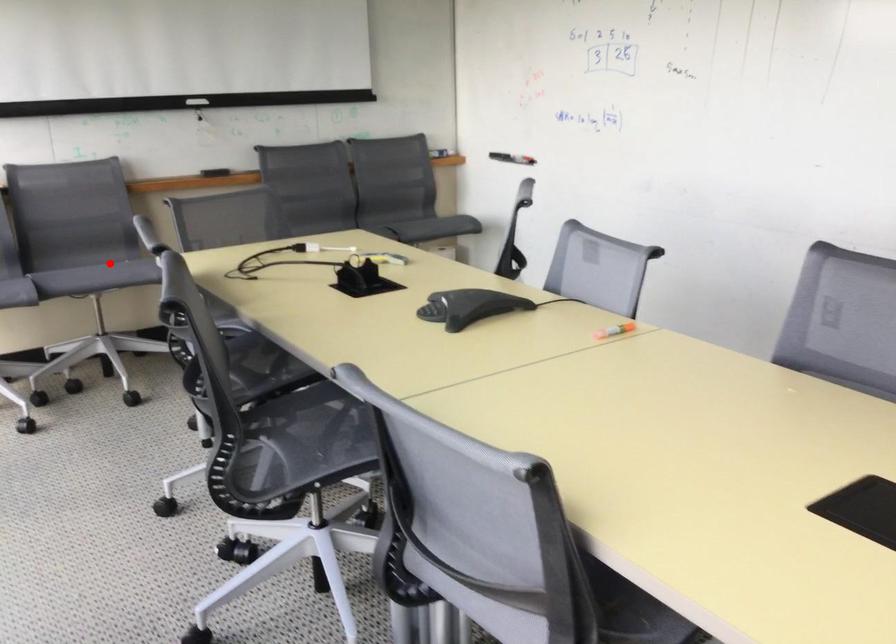
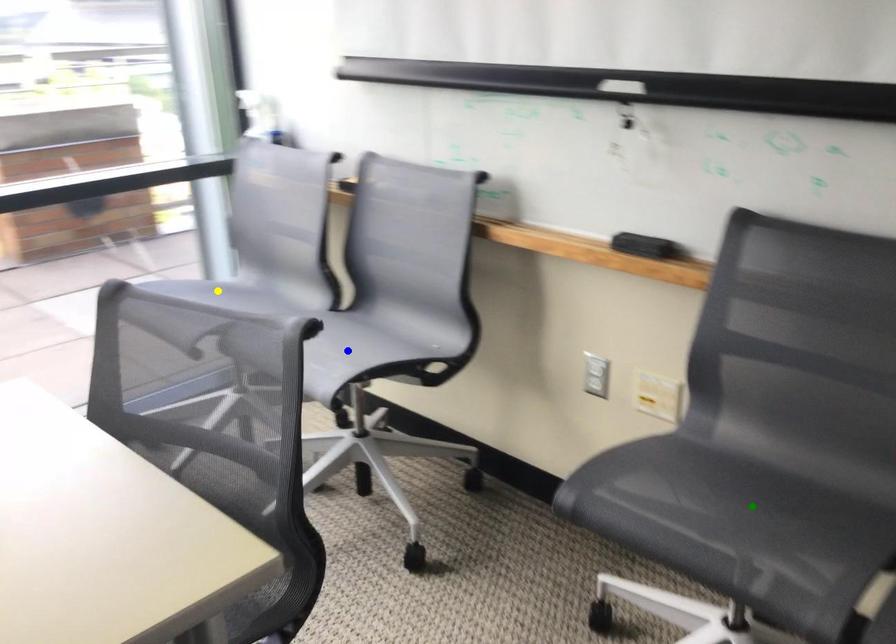
Question: I am providing you with two images of the same scene from different viewpoints. A red point is marked on the first image. You are given multiple points on the second image. In image 2, which mark is for the same physical point as the one in image 1?

Choices:
 (A) yellow point
 (B) blue point
 (C) green point

Answer: (B)